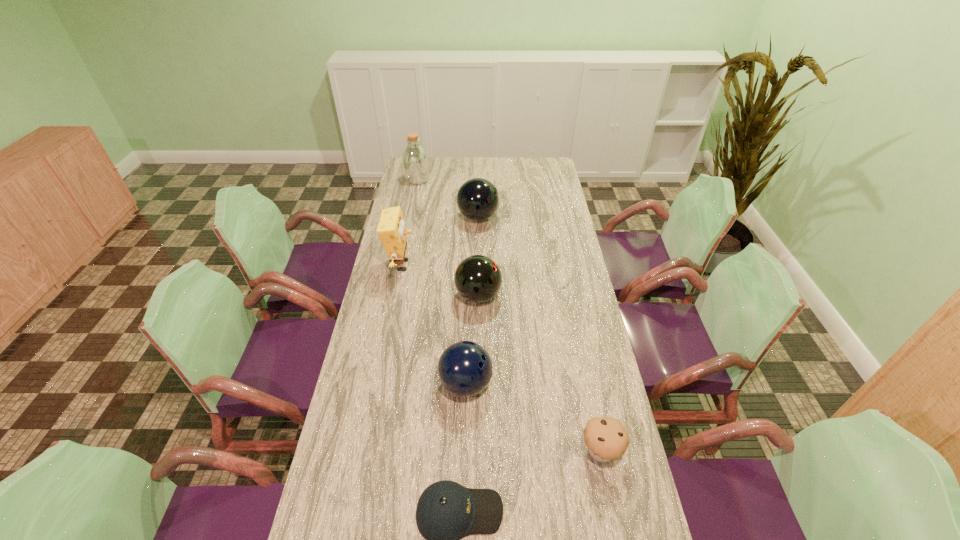
Identify the location of the farthest object. (415, 159).

What are the coordinates of `sponge` in the screenshot? It's located at (391, 230).

The height and width of the screenshot is (540, 960). Find the location of `the second farthest object`. the second farthest object is located at coordinates (477, 199).

Where is `the second nearest bowling ball`? Image resolution: width=960 pixels, height=540 pixels. the second nearest bowling ball is located at coordinates pyautogui.click(x=478, y=278).

Locate an element on the screen. Image resolution: width=960 pixels, height=540 pixels. the nearest bowling ball is located at coordinates (465, 368).

You are a GUI agent. You are given a task and a screenshot of the screen. Output one action in this format:
    pyautogui.click(x=<x>, y=<y>)
    Task: Click on the rightmost object
    This screenshot has width=960, height=540.
    Given the screenshot: What is the action you would take?
    pyautogui.click(x=606, y=438)

Image resolution: width=960 pixels, height=540 pixels. Identify the location of muffin. (606, 438).

This screenshot has width=960, height=540. What are the coordinates of `free space located on the right of the farthest object` in the screenshot? It's located at (491, 179).

Identify the location of vacant space situated on the face of the sponge. The height and width of the screenshot is (540, 960). (489, 265).

In order to click on vacant position located on the side of the farthest bowling ball with the finger holes in this screenshot , I will do `click(564, 217)`.